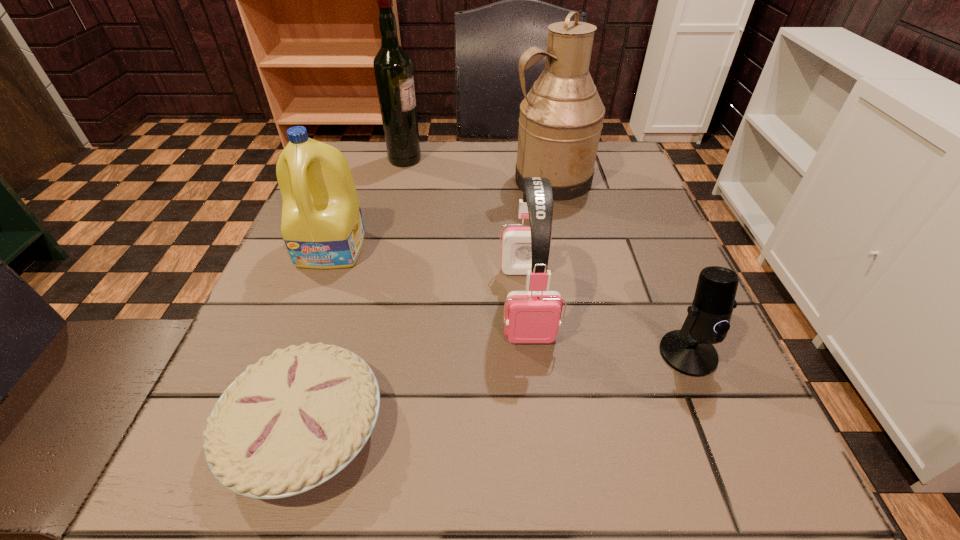
Locate which object is the second closest to the detergent. Please provide its 2D coordinates. Your answer should be formatted as a tuple, i.e. [(x, y)], where the tuple contains the x and y coordinates of a point satisfying the conditions above.

[(393, 68)]

Find the location of a particular element. This screenshot has width=960, height=540. vacant area in the image that satisfies the following two spatial constraints: 1. on the front and back of the wine bottle; 2. on the label of the detergent is located at coordinates (383, 249).

Find the location of a particular element. free space that satisfies the following two spatial constraints: 1. on the front and back of the wine bottle; 2. on the left side of the pitcher is located at coordinates (400, 179).

Where is `free space in the image that satisfies the following two spatial constraints: 1. on the front and back of the wine bottle; 2. on the label of the detergent`? free space in the image that satisfies the following two spatial constraints: 1. on the front and back of the wine bottle; 2. on the label of the detergent is located at coordinates (383, 249).

In order to click on blank area in the image that satisfies the following two spatial constraints: 1. on the front and back of the wine bottle; 2. on the back side of the pitcher in this screenshot , I will do `click(400, 179)`.